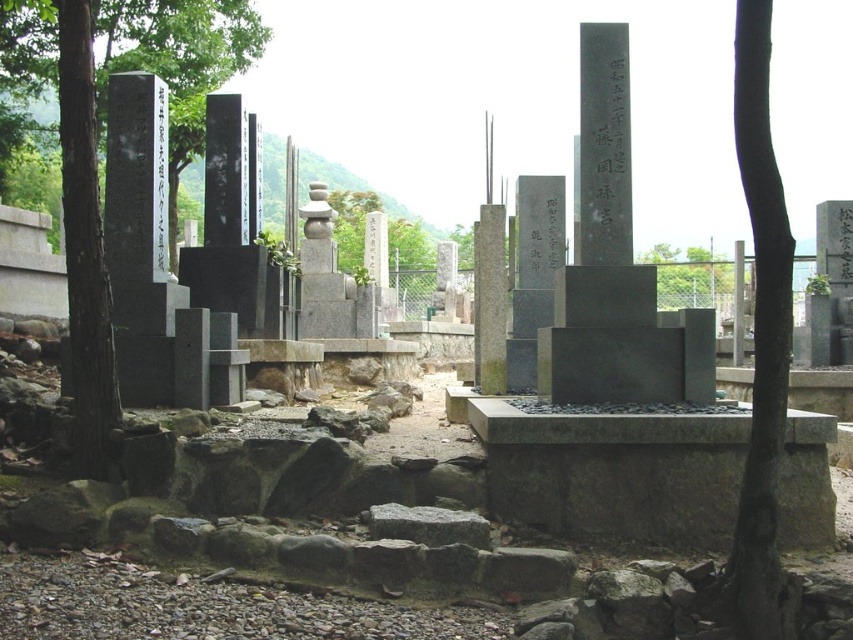
You are a visitor at the cemetery and want to place a bouquet of flowers between the black polished stone pillar at center and the gray polished stone pillar at center. Which pillar should you place the flowers closer to if you want them to be centered between both pillars?

To center the bouquet between the black polished stone pillar at center and the gray polished stone pillar at center, you should place the flowers equidistant from both pillars. However, since the black polished stone pillar at center might be wider than the gray polished stone pillar at center, you should adjust the position slightly closer to the wider pillar to ensure visual balance.

You are standing at the entrance of the cemetery and want to walk to a specific location. You see two points marked in the image. Which point is closer to you, point (x=210, y=161) or point (x=479, y=300)?

Point (x=210, y=161) is closer to you because it is further to the viewer than point (x=479, y=300).